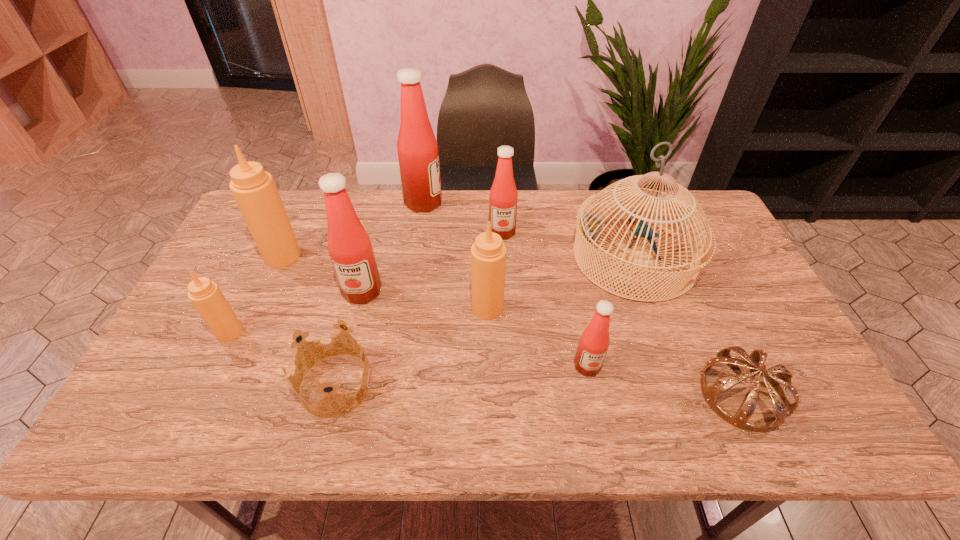
Select which condiment appears as the fifth closest to the nearest condiment. Please provide its 2D coordinates. Your answer should be formatted as a tuple, i.e. [(x, y)], where the tuple contains the x and y coordinates of a point satisfying the conditions above.

[(255, 192)]

Find the location of a particular element. The image size is (960, 540). condiment that is the second closest to the second farthest red condiment is located at coordinates (488, 253).

You are a GUI agent. You are given a task and a screenshot of the screen. Output one action in this format:
    pyautogui.click(x=<x>, y=<y>)
    Task: Click on the red condiment that stands as the second closest to the tiara
    
    Given the screenshot: What is the action you would take?
    pyautogui.click(x=503, y=196)

The height and width of the screenshot is (540, 960). Find the location of `the second closest red condiment relative to the sixth nearest condiment`. the second closest red condiment relative to the sixth nearest condiment is located at coordinates (349, 246).

In order to click on the third closest tan condiment to the crown in this screenshot , I will do `click(255, 192)`.

Select which tan condiment is the second closest to the crown. Please provide its 2D coordinates. Your answer should be formatted as a tuple, i.e. [(x, y)], where the tuple contains the x and y coordinates of a point satisfying the conditions above.

[(488, 253)]

What are the coordinates of `vacant point that satisfies the following two spatial constraints: 1. on the back side of the crown; 2. on the left side of the birdcage` in the screenshot? It's located at (369, 258).

The width and height of the screenshot is (960, 540). What are the coordinates of `vacant area in the image that satisfies the following two spatial constraints: 1. on the front-facing side of the rightmost red condiment; 2. on the left side of the brown tiara` in the screenshot? It's located at (593, 395).